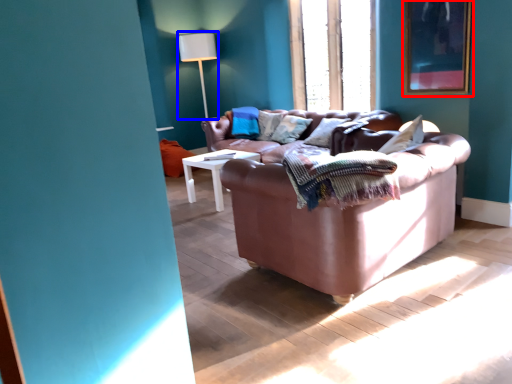
Question: Which object is further to the camera taking this photo, picture frame (highlighted by a red box) or table lamp (highlighted by a blue box)?

Choices:
 (A) picture frame
 (B) table lamp

Answer: (B)